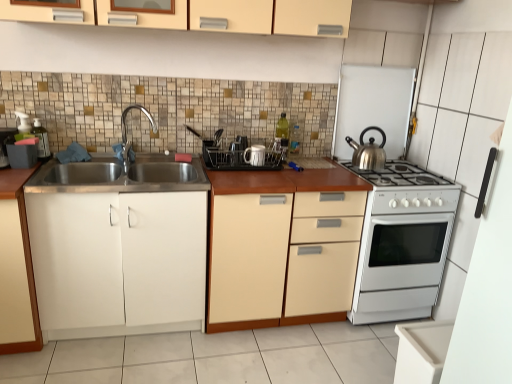
Find the location of `vacant space in front of white glossy mug at center, the 4th appliance viewed from the left`. vacant space in front of white glossy mug at center, the 4th appliance viewed from the left is located at coordinates (252, 176).